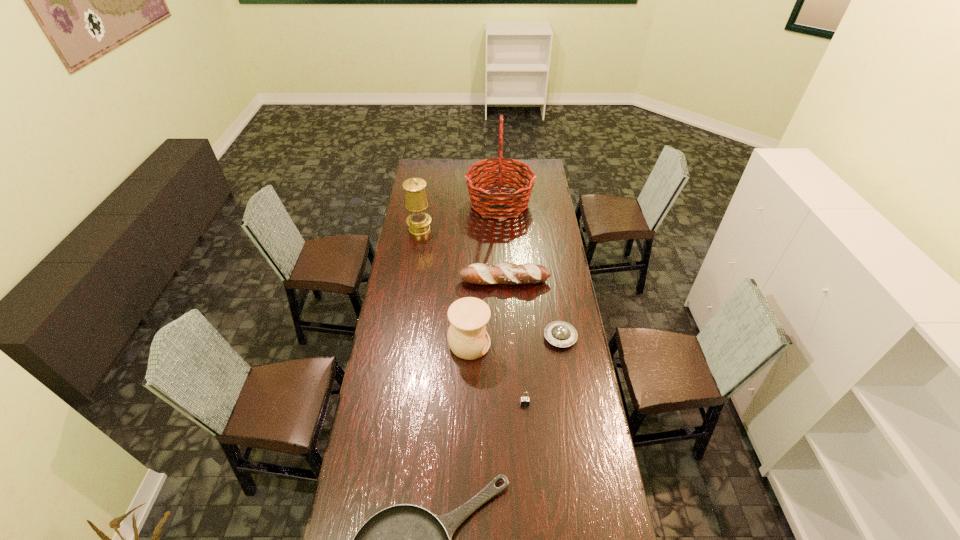
You are a GUI agent. You are given a task and a screenshot of the screen. Output one action in this format:
    pyautogui.click(x=<x>, y=<y>)
    Task: Click on the basket
    The width and height of the screenshot is (960, 540).
    Given the screenshot: What is the action you would take?
    pyautogui.click(x=499, y=203)

Locate an element on the screen. Image resolution: width=960 pixels, height=540 pixels. the second tallest object is located at coordinates (418, 221).

At what (x,y) coordinates should I click in order to perform the action: click on the third tallest object. Please return your answer as a coordinate pair (x, y). Looking at the image, I should click on (467, 337).

At what (x,y) coordinates should I click in order to perform the action: click on the fifth nearest object. Please return your answer as a coordinate pair (x, y). The image size is (960, 540). Looking at the image, I should click on (507, 273).

In order to click on the second nearest object in this screenshot , I will do `click(524, 401)`.

This screenshot has width=960, height=540. Identify the location of the third shortest object. (524, 401).

The height and width of the screenshot is (540, 960). I want to click on saucer, so [x=559, y=333].

Where is `vacant space located 0.070m on the back of the tallest object`? vacant space located 0.070m on the back of the tallest object is located at coordinates (498, 178).

In order to click on vacant space located 0.150m on the back of the sixth shortest object in this screenshot , I will do `click(423, 205)`.

In order to click on vacant position located at the open side of the third tallest object in this screenshot , I will do `click(521, 343)`.